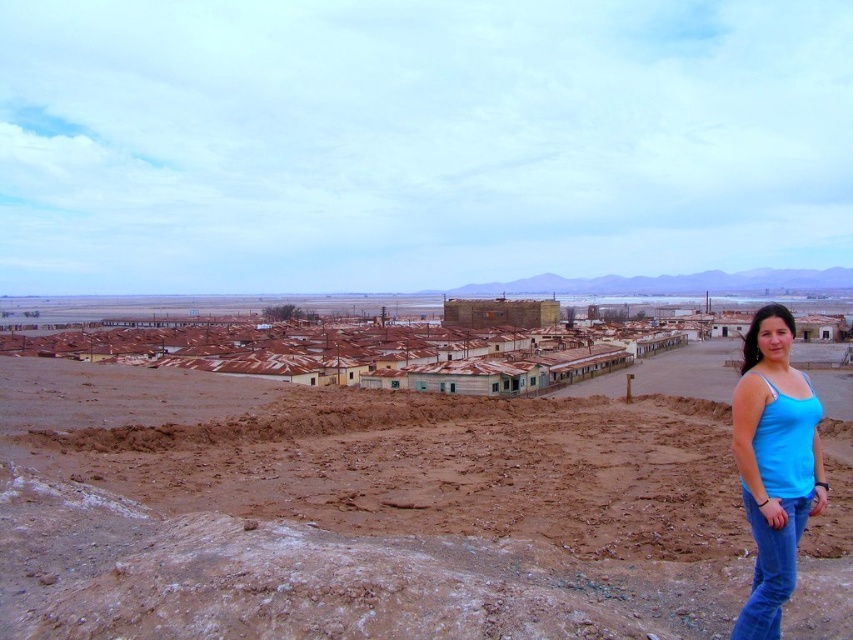
Question: Which of the following is the closest to the observer?

Choices:
 (A) (788, 353)
 (B) (476, 548)
 (C) (549, 372)

Answer: (B)

Question: Is rusty metal rooftops at center bigger than blue cotton tank top at lower right?

Choices:
 (A) yes
 (B) no

Answer: (A)

Question: Is rusty metal rooftops at center to the left of blue cotton tank top at lower right from the viewer's perspective?

Choices:
 (A) no
 (B) yes

Answer: (B)

Question: Considering the relative positions of brown sandy dirt field at lower center and blue cotton tank top at lower right in the image provided, where is brown sandy dirt field at lower center located with respect to blue cotton tank top at lower right?

Choices:
 (A) right
 (B) left

Answer: (B)

Question: Which point is farther from the camera taking this photo?

Choices:
 (A) (763, 496)
 (B) (498, 486)

Answer: (B)

Question: Among these points, which one is farthest from the camera?

Choices:
 (A) (827, 396)
 (B) (780, 356)

Answer: (A)